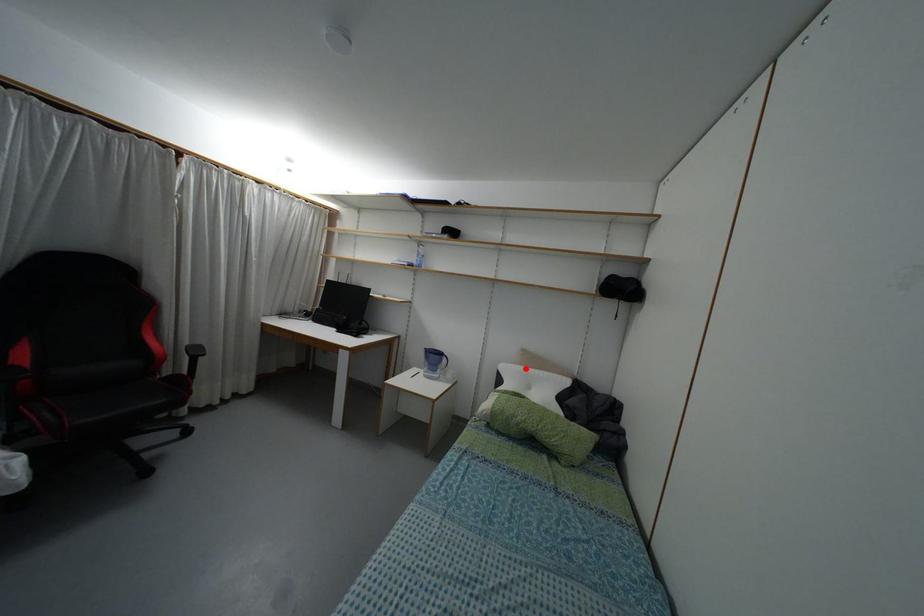
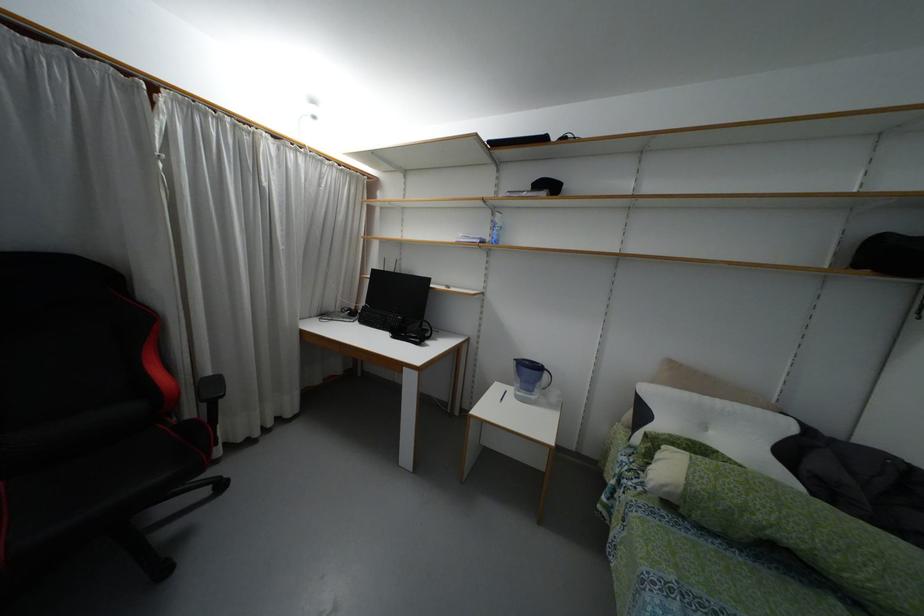
Question: I am providing you with two images of the same scene from different viewpoints. Image1 has a red point marked. In image2, the corresponding 3D location appears at what relative position? Reply with the corresponding letter.

Choices:
 (A) Closer
 (B) Farther

Answer: (A)